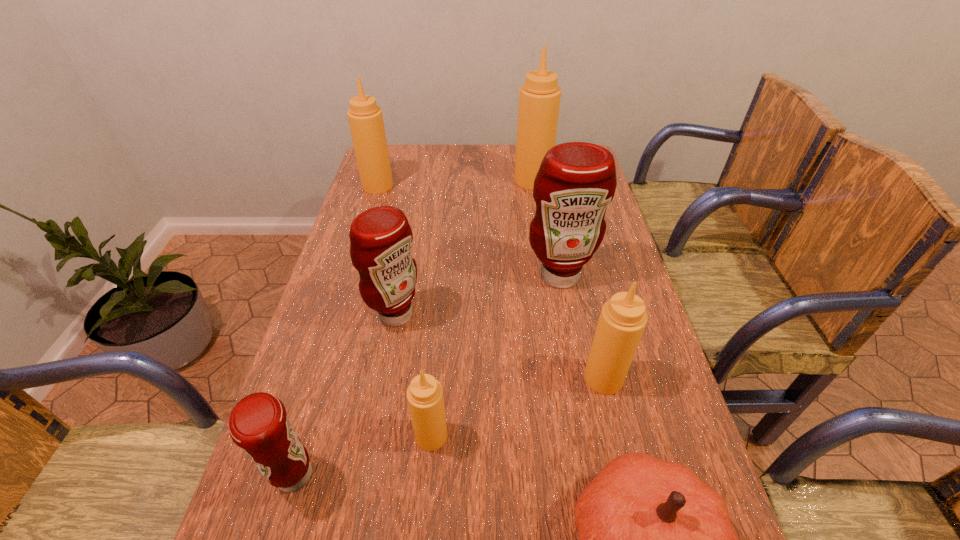
At what (x,y) coordinates should I click in order to perform the action: click on the fifth object from right to left. Please return your answer as a coordinate pair (x, y). The height and width of the screenshot is (540, 960). Looking at the image, I should click on (425, 398).

This screenshot has height=540, width=960. What are the coordinates of `the smallest red condiment` in the screenshot? It's located at (258, 424).

Locate an element on the screen. the leftmost red condiment is located at coordinates coord(258,424).

Identify the location of vacant space positioned 0.210m on the back of the biggest tan condiment. (526, 144).

At what (x,y) coordinates should I click in order to perform the action: click on vacant space situated on the back of the second biggest tan condiment. Please return your answer as a coordinate pair (x, y). This screenshot has height=540, width=960. Looking at the image, I should click on (387, 156).

Image resolution: width=960 pixels, height=540 pixels. What are the coordinates of `vacant space situated 0.100m on the left of the sixth nearest object` in the screenshot? It's located at (489, 276).

Find the location of a particular element. The image size is (960, 540). free location located 0.300m on the back of the third condiment from left to right is located at coordinates (412, 226).

The image size is (960, 540). I want to click on free region located 0.210m on the left of the fourth nearest object, so click(491, 378).

You are a GUI agent. You are given a task and a screenshot of the screen. Output one action in this format:
    pyautogui.click(x=<x>, y=<y>)
    Task: Click on the free space located 0.250m on the right of the smallest tan condiment
    
    Given the screenshot: What is the action you would take?
    pyautogui.click(x=571, y=436)

At what (x,y) coordinates should I click in order to perform the action: click on vacant region located on the right of the smallest red condiment. Please return your answer as a coordinate pair (x, y). Looking at the image, I should click on (424, 476).